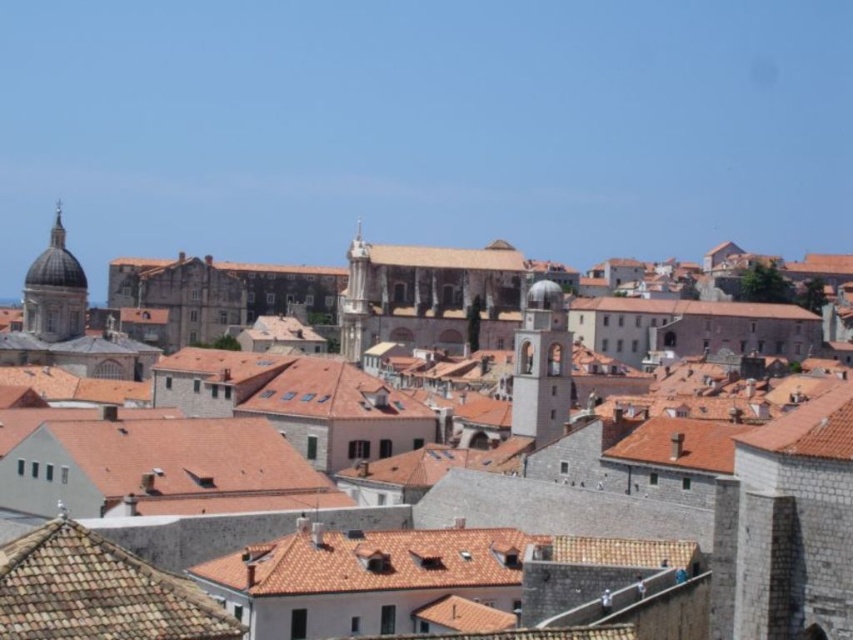
You are an architect analyzing the cityscape. You see the smooth stone bell tower at center and the smooth stone tower at center. Which one is shorter?

The smooth stone bell tower at center is shorter than the smooth stone tower at center according to the description.